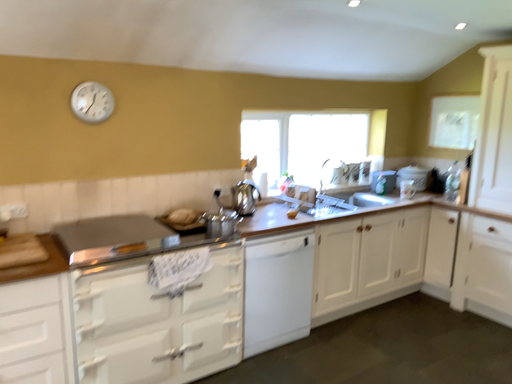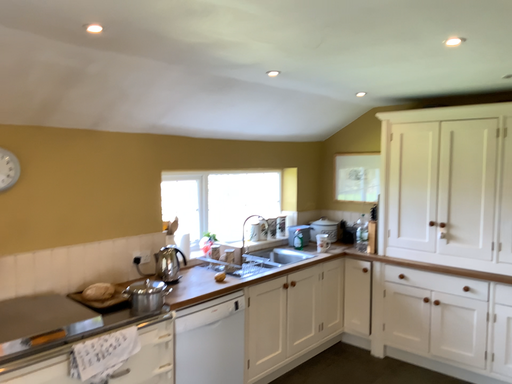
Question: Which way did the camera rotate in the video?

Choices:
 (A) rotated downward
 (B) rotated upward

Answer: (B)